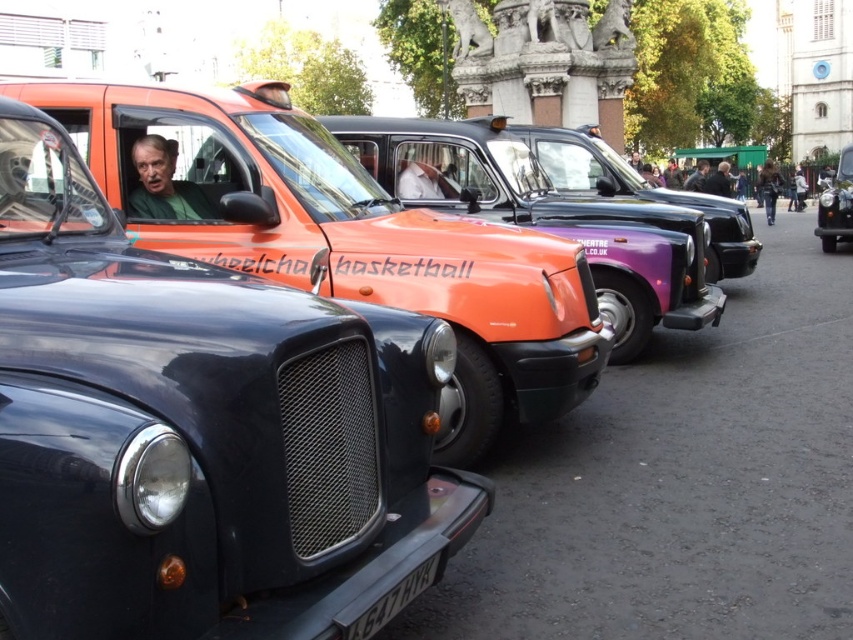
Which is below, shiny orange taxi at center or shiny black taxi at right?

shiny orange taxi at center

This screenshot has width=853, height=640. What are the coordinates of `shiny orange taxi at center` in the screenshot? It's located at (352, 241).

From the picture: Who is taller, orange matte taxi at center or denim jacket at lower right?

denim jacket at lower right is taller.

Image resolution: width=853 pixels, height=640 pixels. In order to click on orange matte taxi at center in this screenshot , I will do `click(558, 220)`.

Does shiny orange taxi at center have a lesser height compared to denim jacket at lower right?

Yes.

Between shiny orange taxi at center and denim jacket at lower right, which one is positioned higher?

denim jacket at lower right is above.

Find the location of a particular element. shiny orange taxi at center is located at coordinates (352, 241).

This screenshot has width=853, height=640. I want to click on shiny orange taxi at center, so click(352, 241).